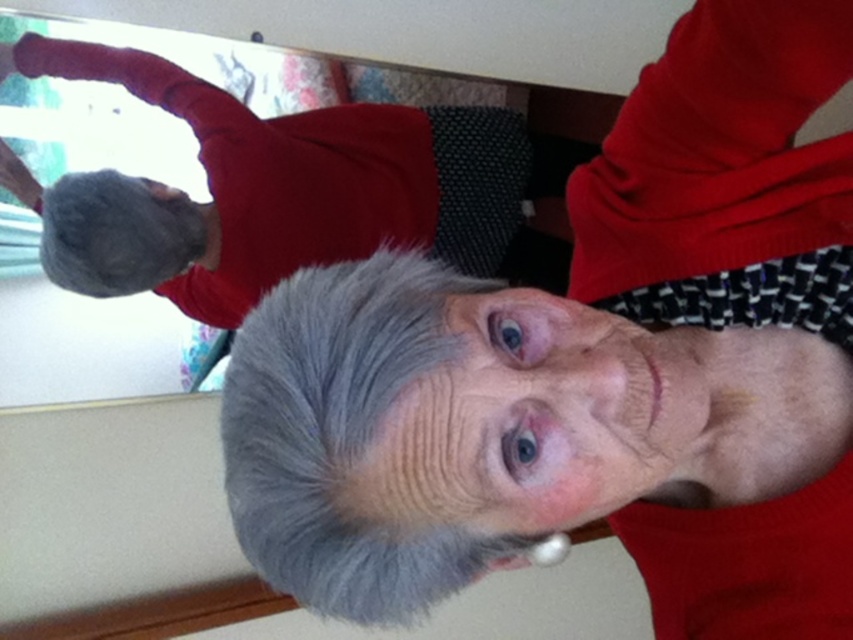
Does gray hair at center have a lesser height compared to gray wool sweater at upper left?

Correct, gray hair at center is not as tall as gray wool sweater at upper left.

Who is more forward, (389, 429) or (473, 250)?

Point (389, 429)

Where is `gray hair at center`? gray hair at center is located at coordinates (590, 369).

Which is behind, point (271, 380) or point (107, 292)?

Point (107, 292)

Is gray fluffy hair at center shorter than fuzzy wool glove at upper left?

Indeed, gray fluffy hair at center has a lesser height compared to fuzzy wool glove at upper left.

Identify the location of gray fluffy hair at center. This screenshot has height=640, width=853. (341, 436).

Find the location of `gray fluffy hair at center`. gray fluffy hair at center is located at coordinates click(341, 436).

Can you confirm if gray hair at center is positioned to the right of fuzzy wool glove at upper left?

Indeed, gray hair at center is positioned on the right side of fuzzy wool glove at upper left.

Does point (660, 120) come behind point (54, 188)?

No.

The width and height of the screenshot is (853, 640). I want to click on gray hair at center, so click(590, 369).

At what (x,y) coordinates should I click in order to perform the action: click on gray hair at center. Please return your answer as a coordinate pair (x, y). Looking at the image, I should click on (590, 369).